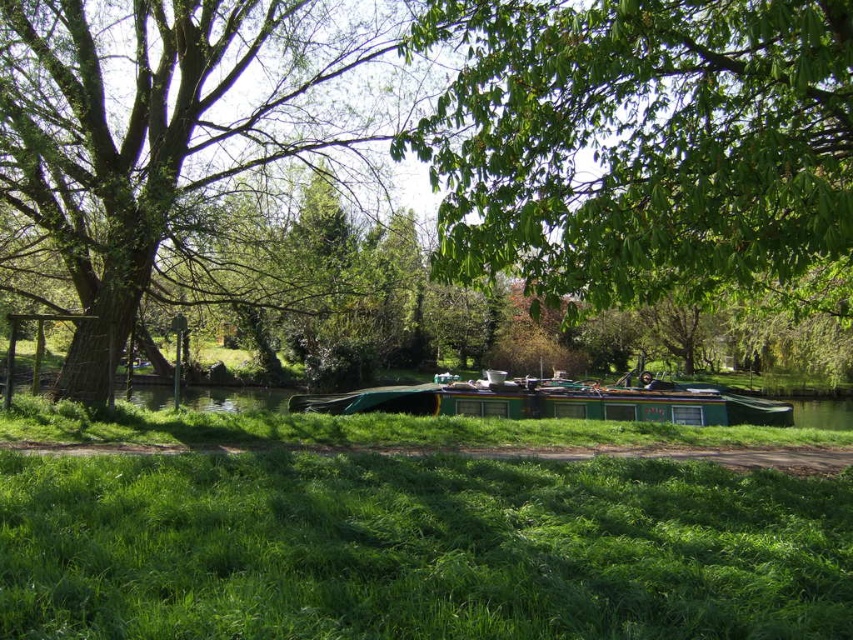
You are standing at the starting point of the dirt path in the riverside scene. You see two points marked in the image. Which point is closer to you, point (97,180) or point (790,426)?

Point (97,180) is closer to the camera than point (790,426), so the point closer to you is point (97,180).

You are standing on the dirt path next to the green grass and want to walk to the green matte boat at center. Is the green leafy tree at left blocking your path?

The green leafy tree at left is positioned over the green matte boat at center, so it might block your path depending on the tree canopy density. However, the description does not specify if the branches extend low enough to obstruct the dirt path. Without more information, it is uncertain if the tree is blocking the path.

You are a photographer planning to capture the green leafy tree at left and the green matte boat at center in a single shot. Given that the tree is shorter than the boat, will the entire tree and boat fit vertically in the frame if you position your camera to include both?

The green leafy tree at left is not as tall as the green matte boat at center, so the entire tree and boat will fit vertically in the frame when positioned to include both.